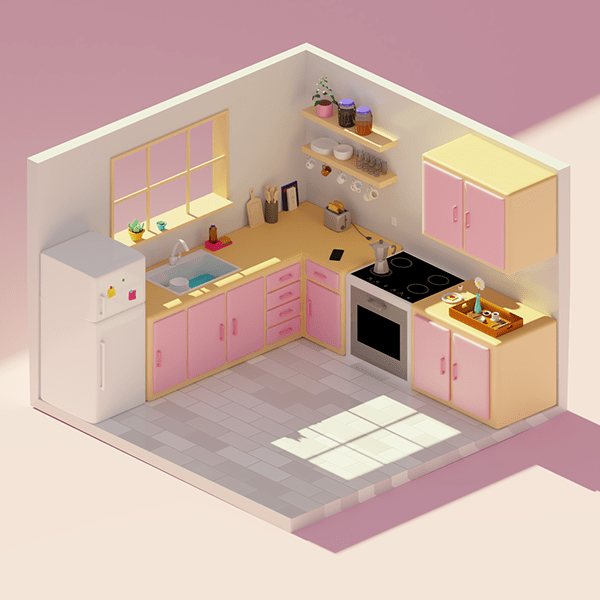
Where is `lavender rug`? The image size is (600, 600). lavender rug is located at coordinates (553, 449), (455, 485).